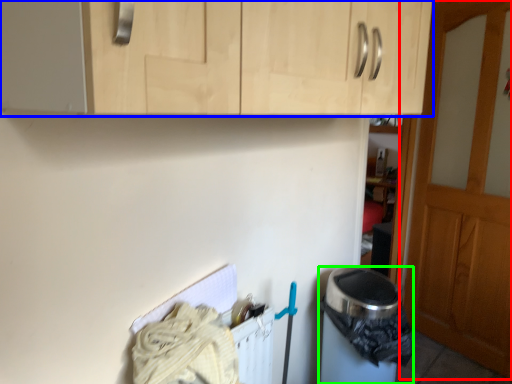
Question: Which is farther away from door (highlighted by a red box)? cabinetry (highlighted by a blue box) or appliance (highlighted by a green box)?

Choices:
 (A) cabinetry
 (B) appliance

Answer: (A)